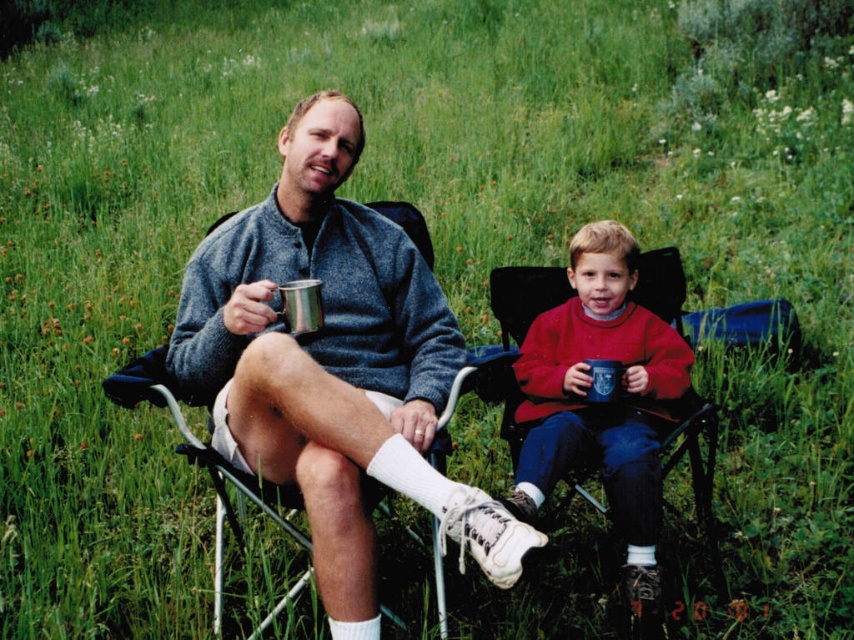
Question: Is matte red sweater at center above metallic folding chair at center?

Choices:
 (A) yes
 (B) no

Answer: (A)

Question: Does matte red sweater at center have a smaller size compared to metallic folding chair at center?

Choices:
 (A) yes
 (B) no

Answer: (A)

Question: Is matte red sweater at center behind metallic folding chair at center?

Choices:
 (A) no
 (B) yes

Answer: (B)

Question: Which object appears closest to the camera in this image?

Choices:
 (A) matte red sweater at center
 (B) metallic folding chair at center

Answer: (B)

Question: Which of the following is the farthest from the observer?

Choices:
 (A) metallic folding chair at center
 (B) matte red sweater at center

Answer: (B)